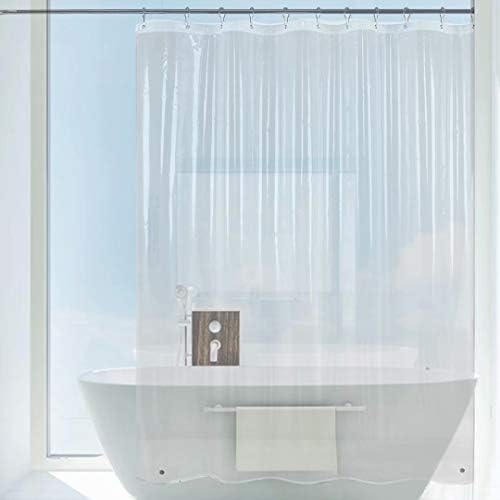
Where is `window`? window is located at coordinates (97, 206).